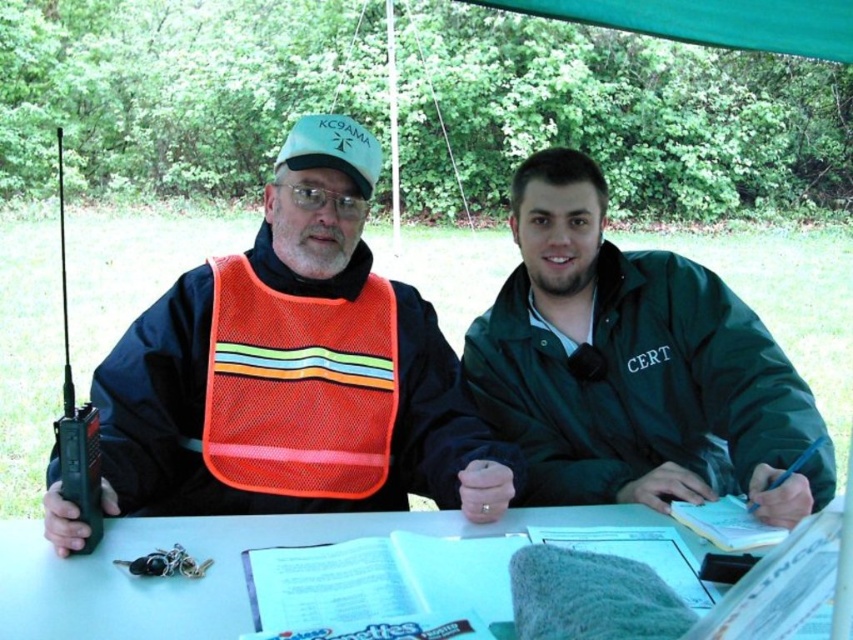
Question: Which object is the closest to the white paper at center?

Choices:
 (A) orange mesh safety vest at center
 (B) orange mesh vest at left

Answer: (B)

Question: Is orange mesh vest at left in front of white paper at center?

Choices:
 (A) no
 (B) yes

Answer: (A)

Question: Which object appears farthest from the camera in this image?

Choices:
 (A) white paper at center
 (B) green matte jacket at center

Answer: (B)

Question: In this image, where is green matte jacket at center located relative to orange mesh safety vest at center?

Choices:
 (A) below
 (B) above

Answer: (A)

Question: Is orange mesh safety vest at center behind white paper at center?

Choices:
 (A) no
 (B) yes

Answer: (B)

Question: Which of these objects is positioned closest to the orange mesh vest at left?

Choices:
 (A) orange mesh safety vest at center
 (B) white paper at center

Answer: (A)